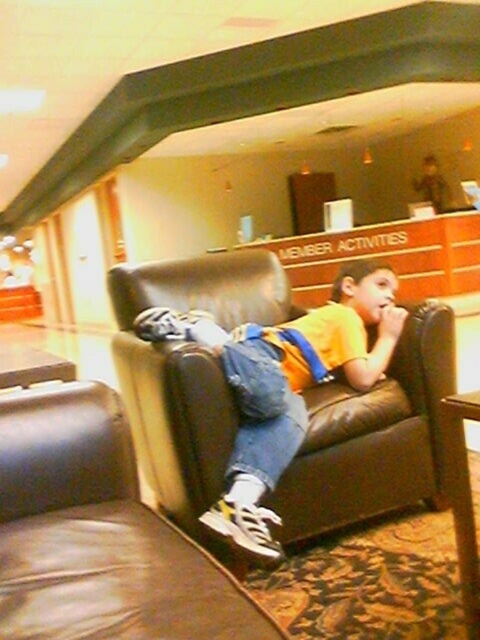
You are a delivery robot with a 1 meter wide package. You need to place the package between the brown leather armchair at center and the matte yellow shirt at center. Is there enough space to fit the package there?

The brown leather armchair at center and matte yellow shirt at center are 81.44 centimeters apart from each other. Since the package is 1 meter wide, there isn not enough space to fit the package between them.

You are a photographer trying to capture the boy in the lounge area. Since the brown leather armchair at center and the matte yellow shirt at center are both at the center, which one is closer to the camera?

The brown leather armchair at center has a smaller size compared to matte yellow shirt at center, so the matte yellow shirt at center is closer to the camera.

You are a photographer trying to capture the boy in the lounge area. You want to ensure the brown leather armchair at center and the matte yellow shirt at center are both visible in the frame. Based on their positions, which object is closer to the camera?

The brown leather armchair at center is positioned under the matte yellow shirt at center, meaning the shirt is closer to the camera than the armchair.